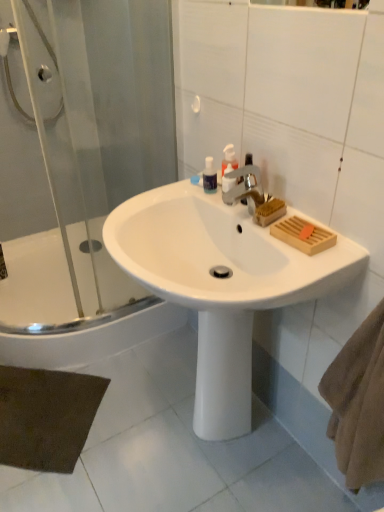
Question: Is point (352, 265) closer or farther from the camera than point (215, 182)?

Choices:
 (A) farther
 (B) closer

Answer: (B)

Question: In the image, is white glossy sink at center on the left side or the right side of transparent plastic mouthwash at upper center?

Choices:
 (A) right
 (B) left

Answer: (B)

Question: Which object is the closest to the white glossy bathtub at lower left?

Choices:
 (A) silver metallic faucet at center
 (B) transparent plastic mouthwash at upper center
 (C) translucent plastic soap dispenser at upper center
 (D) white glossy sink at center
 (E) brown felt bath mat at lower left

Answer: (E)

Question: Which is nearer to the brown felt bath mat at lower left?

Choices:
 (A) translucent plastic soap dispenser at upper center
 (B) transparent glass shower door at left
 (C) white glossy bathtub at lower left
 (D) silver metallic faucet at center
 (E) transparent plastic mouthwash at upper center

Answer: (C)